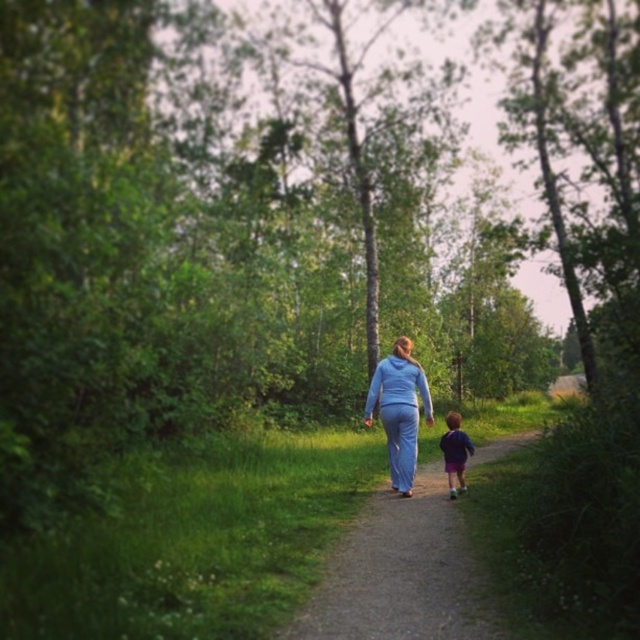
Is dirt path at center shorter than purple fabric boy at lower right?

Yes, dirt path at center is shorter than purple fabric boy at lower right.

Is dirt path at center taller than purple fabric boy at lower right?

Incorrect, dirt path at center's height is not larger of purple fabric boy at lower right's.

What do you see at coordinates (401, 573) in the screenshot? The height and width of the screenshot is (640, 640). I see `dirt path at center` at bounding box center [401, 573].

This screenshot has height=640, width=640. What are the coordinates of `dirt path at center` in the screenshot? It's located at (401, 573).

Is dirt path at center taller than blue fabric pants at center?

In fact, dirt path at center may be shorter than blue fabric pants at center.

Where is `dirt path at center`? The image size is (640, 640). dirt path at center is located at coordinates (401, 573).

Can you confirm if blue fabric pants at center is shorter than purple fabric boy at lower right?

In fact, blue fabric pants at center may be taller than purple fabric boy at lower right.

Locate an element on the screen. This screenshot has width=640, height=640. blue fabric pants at center is located at coordinates (400, 410).

Which is in front, point (380, 392) or point (458, 472)?

Point (380, 392) is more forward.

Where is `blue fabric pants at center`? The width and height of the screenshot is (640, 640). blue fabric pants at center is located at coordinates (400, 410).